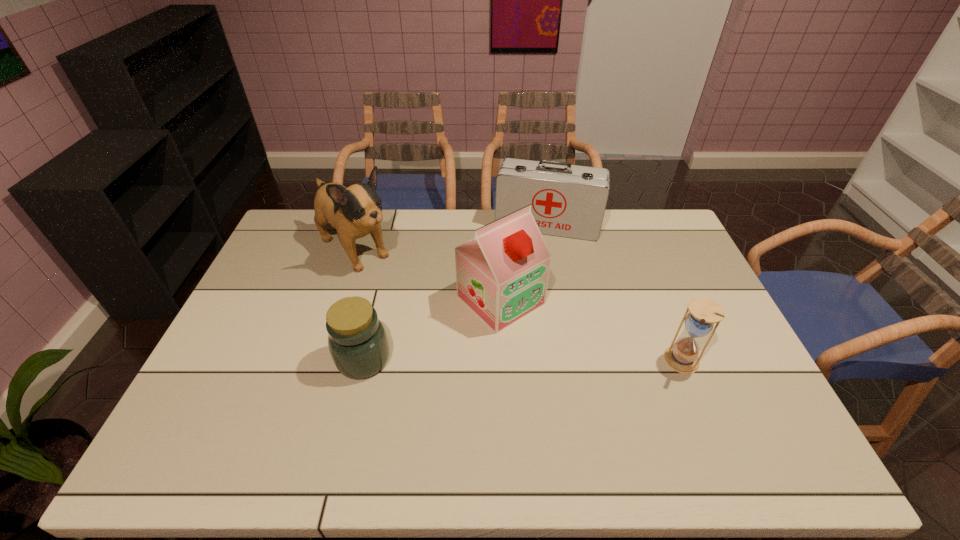
At what (x,y) coordinates should I click in order to perform the action: click on object located at the far left corner. Please return your answer as a coordinate pair (x, y). Looking at the image, I should click on (356, 211).

In order to click on vacant region at the far edge of the desktop in this screenshot , I will do [482, 222].

Identify the location of vacant area at the near edge of the desktop. Image resolution: width=960 pixels, height=540 pixels. (278, 416).

In the image, there is a desktop. Where is `vacant space at the left edge`? The height and width of the screenshot is (540, 960). vacant space at the left edge is located at coordinates click(x=271, y=368).

In the image, there is a desktop. What are the coordinates of `free space at the right edge` in the screenshot? It's located at (704, 343).

Locate an element on the screen. This screenshot has height=540, width=960. free space at the near left corner of the desktop is located at coordinates (204, 422).

Identify the location of free space at the far right corner of the desktop. The height and width of the screenshot is (540, 960). (663, 246).

Where is `vacant region at the near right corner of the desktop`? vacant region at the near right corner of the desktop is located at coordinates (720, 411).

Where is `vacant region between the first-aid kit and the hourglass`? vacant region between the first-aid kit and the hourglass is located at coordinates (614, 293).

Where is `vacant area between the rightmost object and the shortest object`? This screenshot has width=960, height=540. vacant area between the rightmost object and the shortest object is located at coordinates (523, 360).